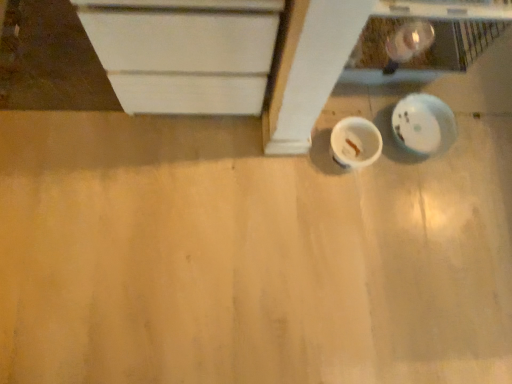
Locate an element on the screen. vacant area in front of white matte cup at center is located at coordinates (343, 204).